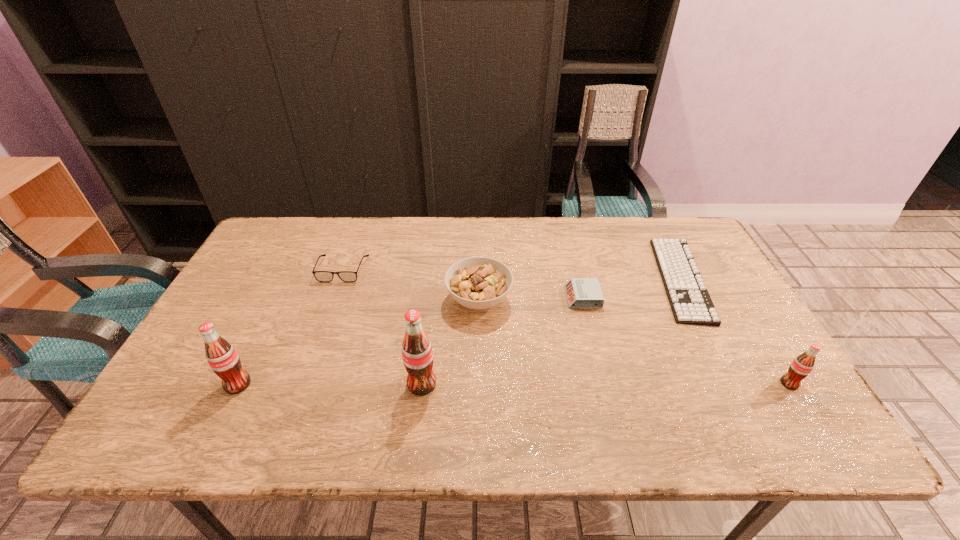
I want to click on unoccupied area between the alarm clock and the fourth object from left to right, so click(x=531, y=299).

Point out which object is positioned as the nearest to the fourth object from left to right. Please provide its 2D coordinates. Your answer should be formatted as a tuple, i.e. [(x, y)], where the tuple contains the x and y coordinates of a point satisfying the conditions above.

[(581, 292)]

Select which object appears as the closest to the sixth object from left to right. Please provide its 2D coordinates. Your answer should be formatted as a tuple, i.e. [(x, y)], where the tuple contains the x and y coordinates of a point satisfying the conditions above.

[(800, 368)]

Identify the location of soda that is the third nearest to the shortest object. The image size is (960, 540). (223, 359).

Identify which soda is the third nearest to the sixth object from left to right. Please provide its 2D coordinates. Your answer should be formatted as a tuple, i.e. [(x, y)], where the tuple contains the x and y coordinates of a point satisfying the conditions above.

[(223, 359)]

Where is `vacant space that satisfies the following two spatial constraints: 1. on the front side of the third tallest object; 2. on the left side of the shortest object`? This screenshot has width=960, height=540. vacant space that satisfies the following two spatial constraints: 1. on the front side of the third tallest object; 2. on the left side of the shortest object is located at coordinates (735, 383).

You are a GUI agent. You are given a task and a screenshot of the screen. Output one action in this format:
    pyautogui.click(x=<x>, y=<y>)
    Task: Click on the free space in the image that satisfies the following two spatial constraints: 1. on the front-facing side of the fifth object from right to left; 2. on the left side of the third shortest object
    The width and height of the screenshot is (960, 540).
    Given the screenshot: What is the action you would take?
    pyautogui.click(x=301, y=384)

Where is `vacant space that satisfies the following two spatial constraints: 1. on the front-facing side of the second object from right to left; 2. on the left side of the third shortest object`? vacant space that satisfies the following two spatial constraints: 1. on the front-facing side of the second object from right to left; 2. on the left side of the third shortest object is located at coordinates click(x=339, y=279).

Locate an element on the screen. This screenshot has width=960, height=540. free region that satisfies the following two spatial constraints: 1. on the front-facing side of the sixth object from right to left; 2. on the left side of the fourth tallest object is located at coordinates (332, 300).